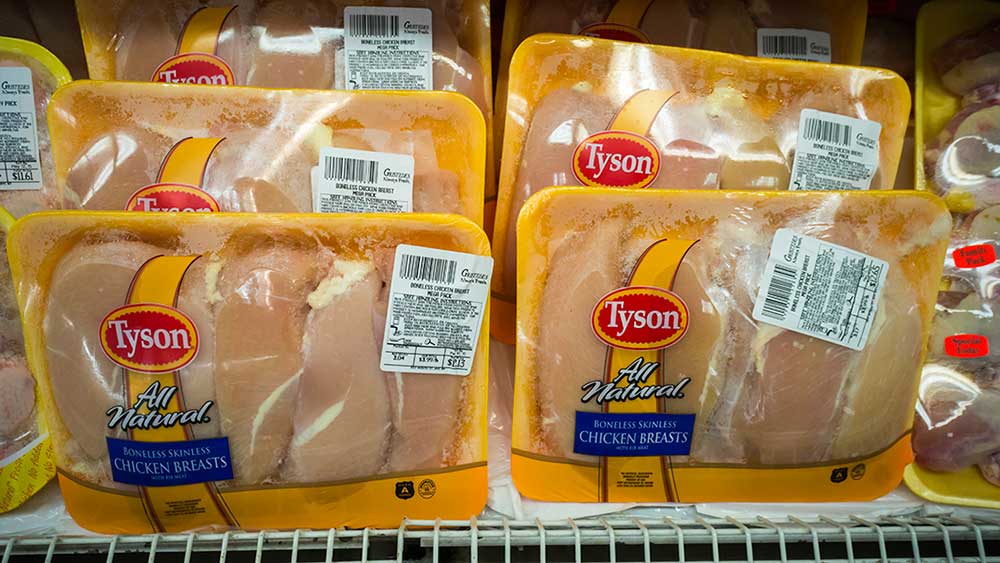
Locate an element on the screen. shelve is located at coordinates (531, 537).